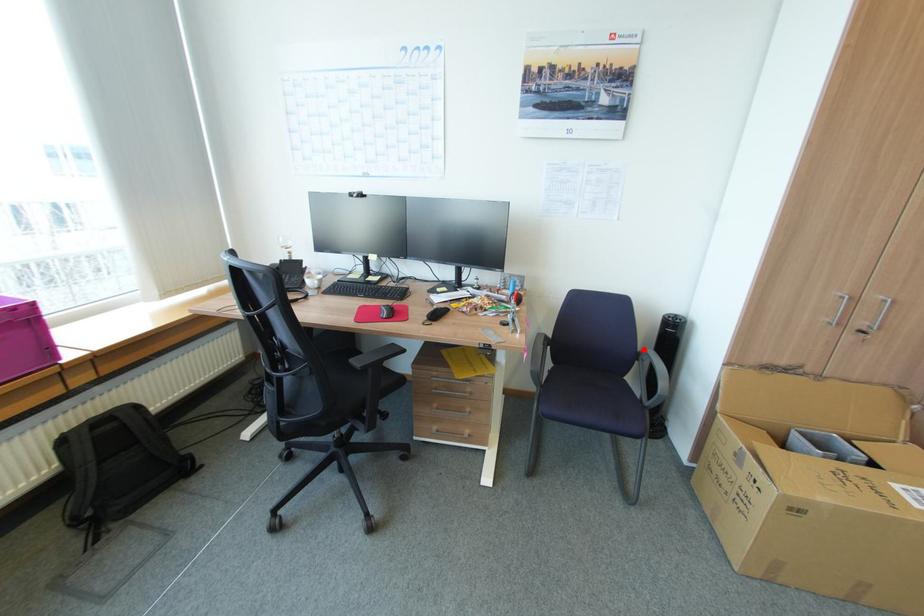
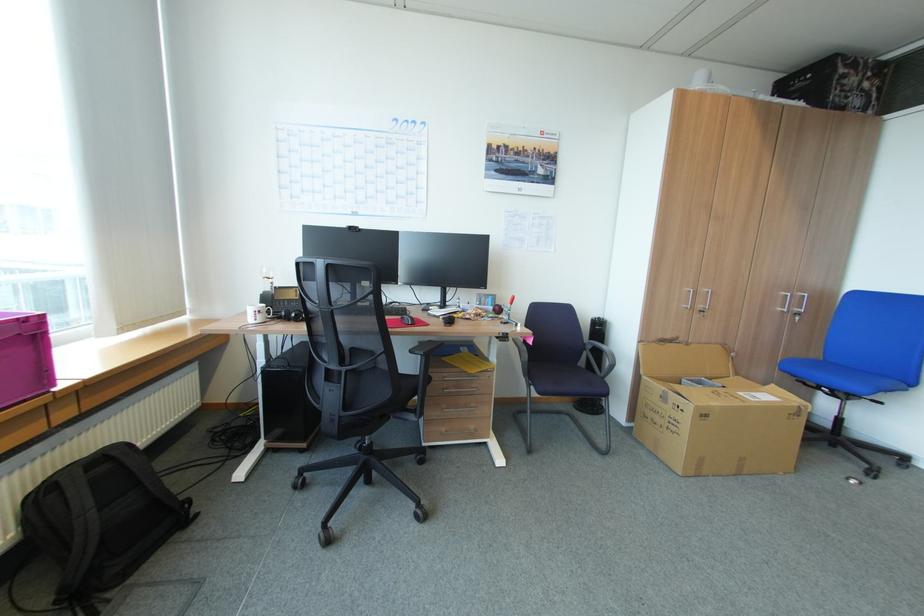
Find the pixel in the second image that matches the highlighted location in the first image.

(590, 342)